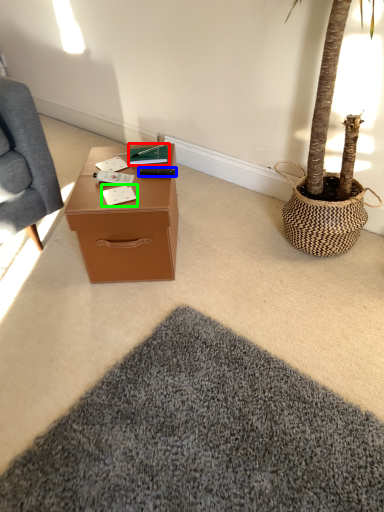
Question: Estimate the real-world distances between objects in this image. Which object is closer to book (highlighted by a red box), remote control (highlighted by a blue box) or notepad (highlighted by a green box)?

Choices:
 (A) remote control
 (B) notepad

Answer: (A)